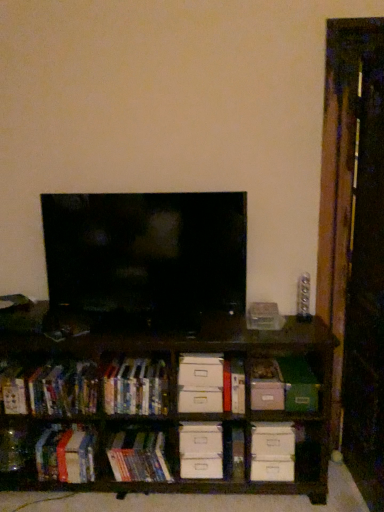
Question: Is hardcover books at left, acting as the 3th book starting from the left, positioned with its back to transparent glass door at right?

Choices:
 (A) no
 (B) yes

Answer: (A)

Question: From the image's perspective, does hardcover books at left, which is counted as the 3th book, starting from the right, appear higher than transparent glass door at right?

Choices:
 (A) yes
 (B) no

Answer: (B)

Question: Is hardcover books at left, acting as the 3th book starting from the left, oriented towards transparent glass door at right?

Choices:
 (A) no
 (B) yes

Answer: (A)

Question: Is hardcover books at left, which is counted as the 3th book, starting from the right, taller than transparent glass door at right?

Choices:
 (A) no
 (B) yes

Answer: (A)

Question: Is hardcover books at left, acting as the 3th book starting from the left, at the right side of transparent glass door at right?

Choices:
 (A) yes
 (B) no

Answer: (B)

Question: Is hardcover books at center, positioned as the 1th book in right-to-left order, inside or outside of white cardboard drawer at center, which is the 1th drawer in top-to-bottom order?

Choices:
 (A) inside
 (B) outside

Answer: (B)

Question: From a real-world perspective, is hardcover books at center, positioned as the 1th book in right-to-left order, above or below white cardboard drawer at center, the 2th drawer from the bottom?

Choices:
 (A) below
 (B) above

Answer: (A)

Question: Considering the positions of point (114, 459) and point (183, 409), is point (114, 459) closer or farther from the camera than point (183, 409)?

Choices:
 (A) farther
 (B) closer

Answer: (A)

Question: From the image's perspective, is hardcover books at center, which ranks as the 5th book in left-to-right order, positioned above or below white cardboard drawer at center, the 2th drawer from the bottom?

Choices:
 (A) below
 (B) above

Answer: (A)

Question: Is point (288, 408) closer or farther from the camera than point (205, 442)?

Choices:
 (A) closer
 (B) farther

Answer: (A)

Question: Which is correct: green matte paper at center-right is inside white cardboard drawer at center, which is the first drawer in bottom-to-top order, or outside of it?

Choices:
 (A) outside
 (B) inside

Answer: (A)

Question: Is green matte paper at center-right in front of or behind white cardboard drawer at center, which is the 2th drawer from top to bottom, in the image?

Choices:
 (A) front
 (B) behind

Answer: (A)

Question: From the image's perspective, is green matte paper at center-right above or below white cardboard drawer at center, which is the 2th drawer from top to bottom?

Choices:
 (A) above
 (B) below

Answer: (A)

Question: From the image's perspective, relative to brown wooden shelf at center, is hardcover books at center, which appears as the second book when viewed from the right, above or below?

Choices:
 (A) above
 (B) below

Answer: (A)

Question: Considering the positions of hardcover books at center, the fourth book when ordered from left to right, and brown wooden shelf at center in the image, is hardcover books at center, the fourth book when ordered from left to right, wider or thinner than brown wooden shelf at center?

Choices:
 (A) thin
 (B) wide

Answer: (A)